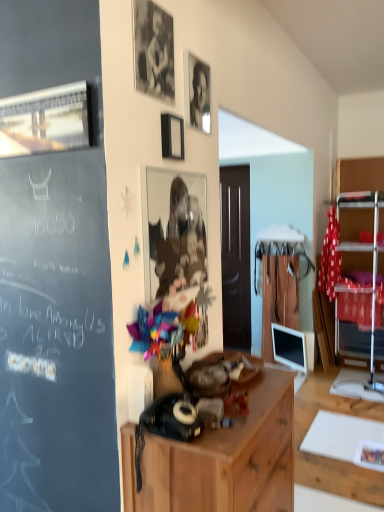
Question: Visually, is metallic silver shelf at right positioned to the left or to the right of metallic reflective photo frame at center, the 1th picture frame from the bottom?

Choices:
 (A) left
 (B) right

Answer: (B)

Question: From the image's perspective, is metallic silver shelf at right located above or below metallic reflective photo frame at center, the 1th picture frame from the bottom?

Choices:
 (A) below
 (B) above

Answer: (B)

Question: Which is farther from the metallic silver picture frame at upper left, which is counted as the fourth picture frame, starting from the right?

Choices:
 (A) wooden cabinet at center
 (B) black glossy photo frame at upper center
 (C) black matte picture frame at upper center, which is the third picture frame in bottom-to-top order
 (D) metallic reflective photo frame at center, which is the 1th picture frame from right to left
 (E) black matte photo frame at upper center, which is the 3th picture frame in right-to-left order

Answer: (A)

Question: Based on their relative distances, which object is nearer to the black glossy photo frame at upper center?

Choices:
 (A) black matte photo frame at upper center, acting as the 4th picture frame starting from the bottom
 (B) black matte picture frame at upper center, which ranks as the second picture frame in right-to-left order
 (C) wooden cabinet at center
 (D) metallic reflective photo frame at center, the 1th picture frame from the bottom
 (E) metallic silver shelf at right

Answer: (B)